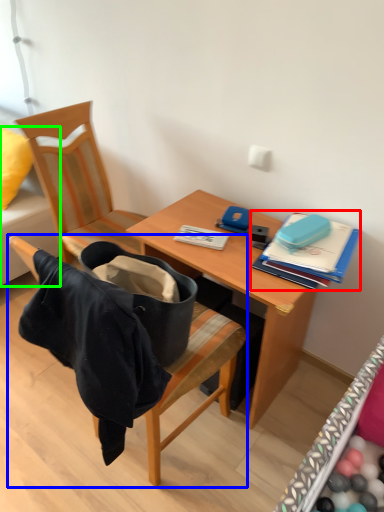
Question: Based on their relative distances, which object is nearer to book (highlighted by a red box)? Choose from chair (highlighted by a blue box) and studio couch (highlighted by a green box).

Choices:
 (A) chair
 (B) studio couch

Answer: (A)